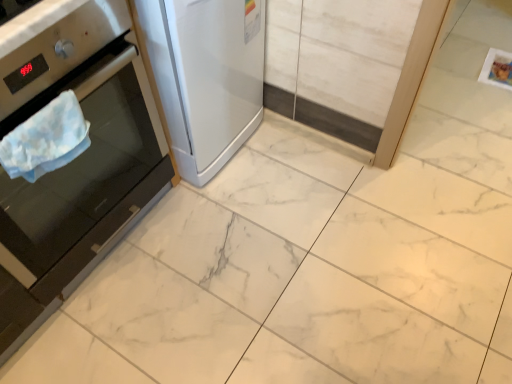
You are a GUI agent. You are given a task and a screenshot of the screen. Output one action in this format:
    pyautogui.click(x=<x>, y=<y>)
    Task: Click on the blue fabric towel at left
    Image resolution: width=512 pixels, height=384 pixels.
    Given the screenshot: What is the action you would take?
    pyautogui.click(x=46, y=139)

Considering the positions of point (53, 122) and point (215, 39), is point (53, 122) closer or farther from the camera than point (215, 39)?

Point (53, 122) is closer to the camera than point (215, 39).

Is blue fabric towel at left at the right side of satin white refrigerator at left, the 2th home appliance when ordered from left to right?

No, blue fabric towel at left is not to the right of satin white refrigerator at left, the 2th home appliance when ordered from left to right.

Is satin white refrigerator at left, the 2th home appliance when ordered from left to right, at the back of blue fabric towel at left?

That's not correct — blue fabric towel at left is not looking away from satin white refrigerator at left, the 2th home appliance when ordered from left to right.

From a real-world perspective, relative to satin white refrigerator at left, arranged as the 1th home appliance when viewed from the right, is blue fabric towel at left vertically above or below?

From a real-world perspective, blue fabric towel at left is physically above satin white refrigerator at left, arranged as the 1th home appliance when viewed from the right.

Is stainless steel oven at left, the second home appliance viewed from the right, in front of blue fabric towel at left?

Yes, stainless steel oven at left, the second home appliance viewed from the right, is in front of blue fabric towel at left.

Measure the distance between stainless steel oven at left, marked as the 1th home appliance in a left-to-right arrangement, and blue fabric towel at left.

8.89 inches.

Are stainless steel oven at left, marked as the 1th home appliance in a left-to-right arrangement, and blue fabric towel at left beside each other?

No.

How different are the orientations of stainless steel oven at left, the second home appliance viewed from the right, and blue fabric towel at left in degrees?

The facing directions of stainless steel oven at left, the second home appliance viewed from the right, and blue fabric towel at left are 0.709 degrees apart.

Is stainless steel oven at left, the second home appliance viewed from the right, positioned with its back to satin white refrigerator at left, the 2th home appliance when ordered from left to right?

stainless steel oven at left, the second home appliance viewed from the right, does not have its back to satin white refrigerator at left, the 2th home appliance when ordered from left to right.

Would you say stainless steel oven at left, the second home appliance viewed from the right, is outside satin white refrigerator at left, the 2th home appliance when ordered from left to right?

That's correct, stainless steel oven at left, the second home appliance viewed from the right, is outside of satin white refrigerator at left, the 2th home appliance when ordered from left to right.

Considering the relative sizes of stainless steel oven at left, the second home appliance viewed from the right, and satin white refrigerator at left, arranged as the 1th home appliance when viewed from the right, in the image provided, is stainless steel oven at left, the second home appliance viewed from the right, bigger than satin white refrigerator at left, arranged as the 1th home appliance when viewed from the right,?

Yes.

Is stainless steel oven at left, marked as the 1th home appliance in a left-to-right arrangement, at the left side of satin white refrigerator at left, the 2th home appliance when ordered from left to right?

Indeed, stainless steel oven at left, marked as the 1th home appliance in a left-to-right arrangement, is positioned on the left side of satin white refrigerator at left, the 2th home appliance when ordered from left to right.

Does blue fabric towel at left have a greater height compared to stainless steel oven at left, the second home appliance viewed from the right?

Incorrect, the height of blue fabric towel at left is not larger of that of stainless steel oven at left, the second home appliance viewed from the right.

You are a GUI agent. You are given a task and a screenshot of the screen. Output one action in this format:
    pyautogui.click(x=<x>, y=<y>)
    Task: Click on the blanket behind the stainless steel oven at left, marked as the 1th home appliance in a left-to-right arrangement
    This screenshot has height=384, width=512.
    Given the screenshot: What is the action you would take?
    pyautogui.click(x=46, y=139)

From the picture: Which object is more forward, blue fabric towel at left or stainless steel oven at left, the second home appliance viewed from the right?

Positioned in front is stainless steel oven at left, the second home appliance viewed from the right.

Does blue fabric towel at left have a lesser width compared to stainless steel oven at left, marked as the 1th home appliance in a left-to-right arrangement?

Indeed, blue fabric towel at left has a lesser width compared to stainless steel oven at left, marked as the 1th home appliance in a left-to-right arrangement.

Does satin white refrigerator at left, the 2th home appliance when ordered from left to right, have a smaller size compared to blue fabric towel at left?

Actually, satin white refrigerator at left, the 2th home appliance when ordered from left to right, might be larger than blue fabric towel at left.

Is blue fabric towel at left completely or partially inside satin white refrigerator at left, arranged as the 1th home appliance when viewed from the right?

No, satin white refrigerator at left, arranged as the 1th home appliance when viewed from the right, does not contain blue fabric towel at left.

You are a GUI agent. You are given a task and a screenshot of the screen. Output one action in this format:
    pyautogui.click(x=<x>, y=<y>)
    Task: Click on the blanket above the satin white refrigerator at left, arranged as the 1th home appliance when viewed from the right (from a real-world perspective)
    
    Given the screenshot: What is the action you would take?
    pyautogui.click(x=46, y=139)

From the image's perspective, between satin white refrigerator at left, arranged as the 1th home appliance when viewed from the right, and blue fabric towel at left, which one is located above?

satin white refrigerator at left, arranged as the 1th home appliance when viewed from the right, from the image's perspective.

Considering the positions of points (182, 147) and (50, 247), is point (182, 147) closer to camera compared to point (50, 247)?

No, (182, 147) is behind (50, 247).

Consider the image. Considering the relative sizes of satin white refrigerator at left, arranged as the 1th home appliance when viewed from the right, and stainless steel oven at left, the second home appliance viewed from the right, in the image provided, is satin white refrigerator at left, arranged as the 1th home appliance when viewed from the right, bigger than stainless steel oven at left, the second home appliance viewed from the right,?

No, satin white refrigerator at left, arranged as the 1th home appliance when viewed from the right, is not bigger than stainless steel oven at left, the second home appliance viewed from the right.

From a real-world perspective, which is physically below, satin white refrigerator at left, the 2th home appliance when ordered from left to right, or stainless steel oven at left, marked as the 1th home appliance in a left-to-right arrangement?

satin white refrigerator at left, the 2th home appliance when ordered from left to right, from a real-world perspective.

You are a GUI agent. You are given a task and a screenshot of the screen. Output one action in this format:
    pyautogui.click(x=<x>, y=<y>)
    Task: Click on the home appliance behind the blue fabric towel at left
    
    Given the screenshot: What is the action you would take?
    pyautogui.click(x=206, y=76)

You are a GUI agent. You are given a task and a screenshot of the screen. Output one action in this format:
    pyautogui.click(x=<x>, y=<y>)
    Task: Click on the home appliance that is in front of the blue fabric towel at left
    
    Given the screenshot: What is the action you would take?
    click(x=76, y=162)

When comparing their distances from satin white refrigerator at left, the 2th home appliance when ordered from left to right, does blue fabric towel at left or stainless steel oven at left, the second home appliance viewed from the right, seem closer?

stainless steel oven at left, the second home appliance viewed from the right, is closer to satin white refrigerator at left, the 2th home appliance when ordered from left to right.

Looking at this image, when comparing their distances from stainless steel oven at left, the second home appliance viewed from the right, does blue fabric towel at left or satin white refrigerator at left, the 2th home appliance when ordered from left to right, seem closer?

blue fabric towel at left lies closer to stainless steel oven at left, the second home appliance viewed from the right, than the other object.

From the image, which object appears to be nearer to stainless steel oven at left, marked as the 1th home appliance in a left-to-right arrangement, satin white refrigerator at left, arranged as the 1th home appliance when viewed from the right, or blue fabric towel at left?

blue fabric towel at left lies closer to stainless steel oven at left, marked as the 1th home appliance in a left-to-right arrangement, than the other object.

Which object lies further to the anchor point blue fabric towel at left, stainless steel oven at left, marked as the 1th home appliance in a left-to-right arrangement, or satin white refrigerator at left, the 2th home appliance when ordered from left to right?

satin white refrigerator at left, the 2th home appliance when ordered from left to right, lies further to blue fabric towel at left than the other object.

From the image, which object appears to be farther from blue fabric towel at left, satin white refrigerator at left, arranged as the 1th home appliance when viewed from the right, or stainless steel oven at left, marked as the 1th home appliance in a left-to-right arrangement?

satin white refrigerator at left, arranged as the 1th home appliance when viewed from the right.

Looking at the image, which one is located closer to satin white refrigerator at left, arranged as the 1th home appliance when viewed from the right, stainless steel oven at left, marked as the 1th home appliance in a left-to-right arrangement, or blue fabric towel at left?

Among the two, stainless steel oven at left, marked as the 1th home appliance in a left-to-right arrangement, is located nearer to satin white refrigerator at left, arranged as the 1th home appliance when viewed from the right.

Locate an element on the screen. This screenshot has width=512, height=384. blanket located between stainless steel oven at left, marked as the 1th home appliance in a left-to-right arrangement, and satin white refrigerator at left, the 2th home appliance when ordered from left to right, in the left-right direction is located at coordinates (46, 139).